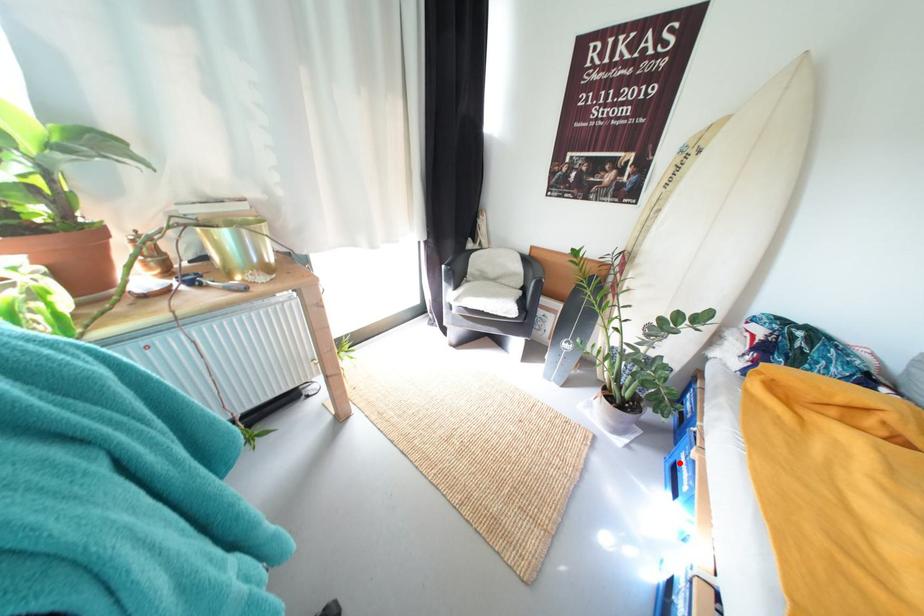
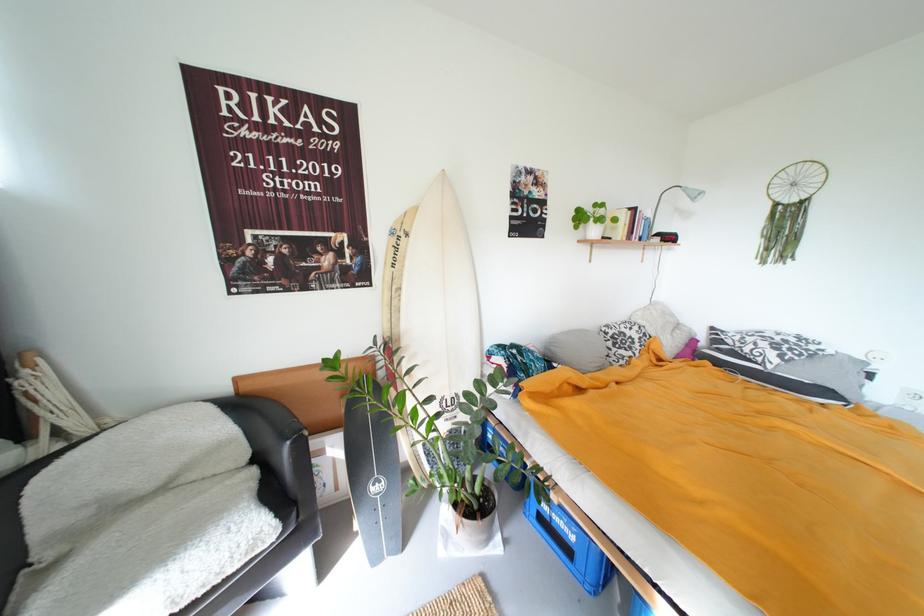
Question: I am providing you with two images of the same scene from different viewpoints. A red point is marked on the first image. Can you still see the location of the red point in image 2?

Choices:
 (A) Yes
 (B) No

Answer: (A)